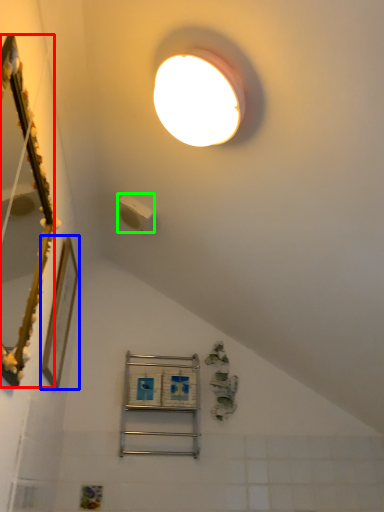
Question: Which is farther away from mirror (highlighted by a red box)? picture frame (highlighted by a blue box) or light switch (highlighted by a green box)?

Choices:
 (A) picture frame
 (B) light switch

Answer: (B)